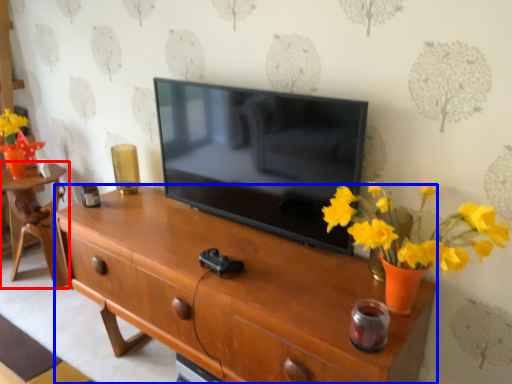
Question: Which point is closer to the camera, table (highlighted by a red box) or desk (highlighted by a blue box)?

Choices:
 (A) table
 (B) desk

Answer: (B)